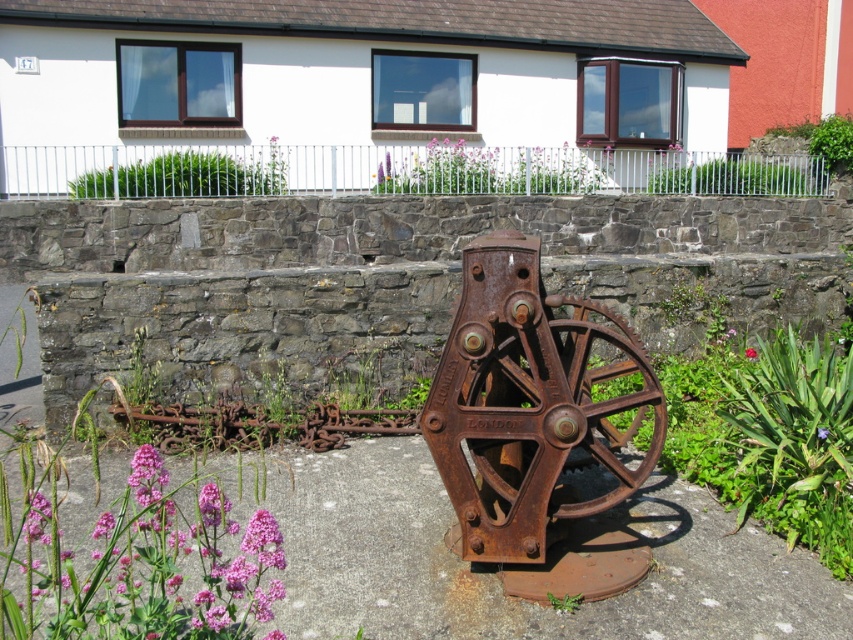
How far apart are rusty metal gear at center and pink matte flower at lower left?

rusty metal gear at center and pink matte flower at lower left are 6.85 feet apart from each other.

Is rusty metal gear at center to the right of pink matte flower at lower left from the viewer's perspective?

Indeed, rusty metal gear at center is positioned on the right side of pink matte flower at lower left.

This screenshot has height=640, width=853. Find the location of `rusty metal gear at center`. rusty metal gear at center is located at coordinates (577, 397).

In the scene shown: Does pink matte flowers at lower left appear on the right side of rusty metal gear at center?

In fact, pink matte flowers at lower left is to the left of rusty metal gear at center.

Between pink matte flowers at lower left and rusty metal gear at center, which one appears on the left side from the viewer's perspective?

From the viewer's perspective, pink matte flowers at lower left appears more on the left side.

Is point (38, 620) closer to camera compared to point (567, 344)?

Yes, it is.

You are a GUI agent. You are given a task and a screenshot of the screen. Output one action in this format:
    pyautogui.click(x=<x>, y=<y>)
    Task: Click on the pink matte flowers at lower left
    
    Given the screenshot: What is the action you would take?
    [148, 568]

Who is more distant from viewer, (505, 456) or (744, 355)?

Positioned behind is point (744, 355).

What do you see at coordinates (577, 397) in the screenshot? This screenshot has width=853, height=640. I see `rusty metal gear at center` at bounding box center [577, 397].

Where is `rusty metal gear at center`? This screenshot has width=853, height=640. rusty metal gear at center is located at coordinates tap(577, 397).